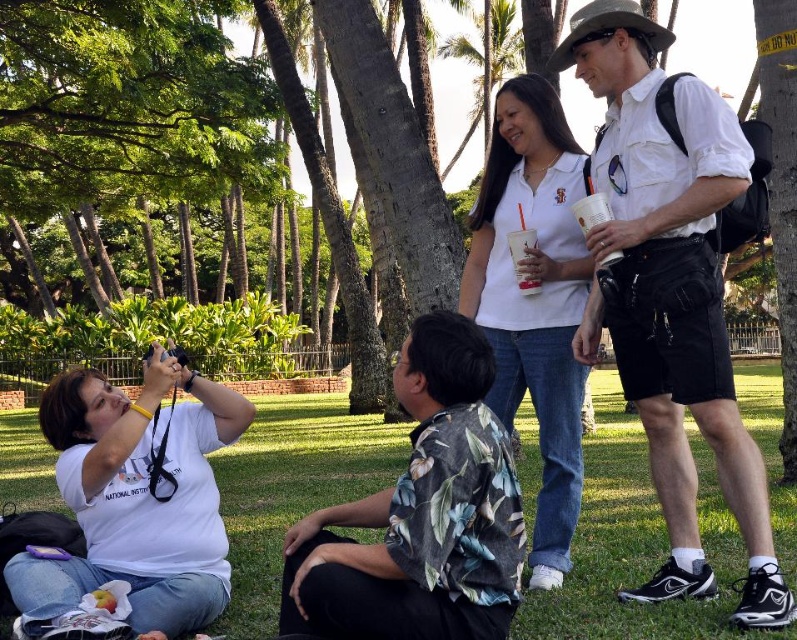
Question: Which object is closer to the camera taking this photo?

Choices:
 (A) white matte shirt at center
 (B) green grass at lower center
 (C) white cotton t-shirt at lower left

Answer: (B)

Question: Which point appears closest to the camera in this image?

Choices:
 (A) (638, 289)
 (B) (487, 356)
 (C) (794, 621)
 (D) (576, 419)

Answer: (B)

Question: Can you confirm if white cotton shirt at upper right is positioned below white cotton t-shirt at lower left?

Choices:
 (A) yes
 (B) no

Answer: (B)

Question: Which of the following is the farthest from the observer?

Choices:
 (A) green grass at lower center
 (B) floral print shirt at center
 (C) white cotton t-shirt at lower left

Answer: (C)

Question: In this image, where is green grass at lower center located relative to white matte shirt at center?

Choices:
 (A) left
 (B) right

Answer: (B)

Question: Does white cotton shirt at upper right come behind floral print shirt at center?

Choices:
 (A) yes
 (B) no

Answer: (A)